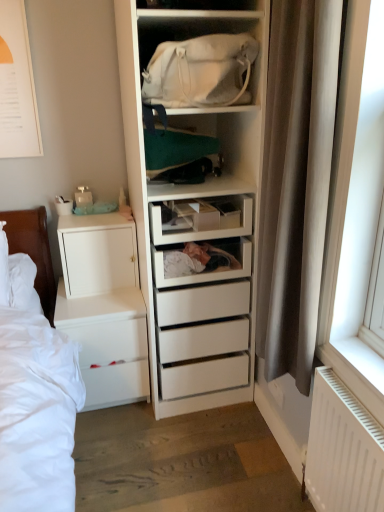
Question: Considering the positions of white matte cabinet at left and white plastic radiator at lower right in the image, is white matte cabinet at left wider or thinner than white plastic radiator at lower right?

Choices:
 (A) wide
 (B) thin

Answer: (A)

Question: From their relative heights in the image, would you say white matte cabinet at left is taller or shorter than white plastic radiator at lower right?

Choices:
 (A) short
 (B) tall

Answer: (A)

Question: Estimate the real-world distances between objects in this image. Which object is farther from the white matte chest of drawers at lower left?

Choices:
 (A) white fabric bag at upper center
 (B) white paper at upper left
 (C) white plastic radiator at lower right
 (D) white matte cabinet at left
 (E) white plastic drawer at center

Answer: (C)

Question: Which of these objects is positioned farthest from the white plastic drawer at center?

Choices:
 (A) brown fabric curtain at right
 (B) white matte cabinet at left
 (C) white fabric bag at upper center
 (D) white matte chest of drawers at lower left
 (E) white plastic radiator at lower right

Answer: (E)